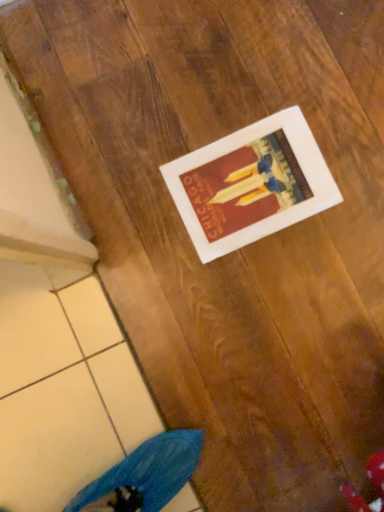
At what (x,y) coordinates should I click in order to perform the action: click on vacant region below white matte picture frame at center (from a real-world perspective). Please return your answer as a coordinate pair (x, y). Looking at the image, I should click on (253, 184).